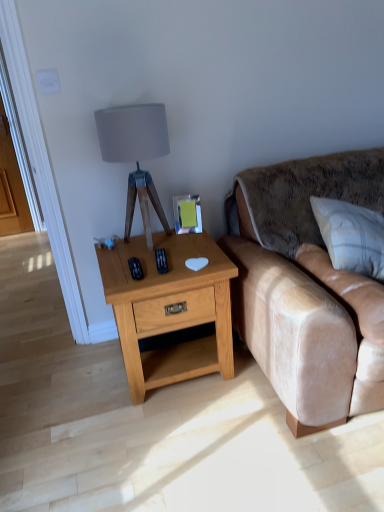
Question: Is the position of white textured pillow at right more distant than that of light oak wood nightstand at center?

Choices:
 (A) yes
 (B) no

Answer: (B)

Question: Is white textured pillow at right not close to light oak wood nightstand at center?

Choices:
 (A) no
 (B) yes

Answer: (A)

Question: From a real-world perspective, is white textured pillow at right on light oak wood nightstand at center?

Choices:
 (A) yes
 (B) no

Answer: (A)

Question: Can you confirm if white textured pillow at right is taller than light oak wood nightstand at center?

Choices:
 (A) yes
 (B) no

Answer: (B)

Question: Is white textured pillow at right in front of light oak wood nightstand at center?

Choices:
 (A) no
 (B) yes

Answer: (B)

Question: In the image, is light oak wood nightstand at center positioned in front of or behind velvet beige couch at right?

Choices:
 (A) front
 (B) behind

Answer: (B)

Question: From a real-world perspective, is light oak wood nightstand at center positioned above or below velvet beige couch at right?

Choices:
 (A) below
 (B) above

Answer: (A)

Question: In terms of height, does light oak wood nightstand at center look taller or shorter compared to velvet beige couch at right?

Choices:
 (A) tall
 (B) short

Answer: (B)

Question: Based on their sizes in the image, would you say light oak wood nightstand at center is bigger or smaller than velvet beige couch at right?

Choices:
 (A) big
 (B) small

Answer: (B)

Question: Relative to white textured pillow at right, is velvet beige couch at right in front or behind?

Choices:
 (A) behind
 (B) front

Answer: (B)

Question: Visually, is velvet beige couch at right positioned to the left or to the right of white textured pillow at right?

Choices:
 (A) right
 (B) left

Answer: (A)

Question: Is velvet beige couch at right situated inside white textured pillow at right or outside?

Choices:
 (A) outside
 (B) inside

Answer: (A)

Question: From a real-world perspective, is velvet beige couch at right positioned above or below white textured pillow at right?

Choices:
 (A) above
 (B) below

Answer: (B)

Question: Is light oak wood nightstand at center to the left or to the right of matte gray fabric lampshade at upper center in the image?

Choices:
 (A) left
 (B) right

Answer: (B)

Question: In terms of height, does light oak wood nightstand at center look taller or shorter compared to matte gray fabric lampshade at upper center?

Choices:
 (A) short
 (B) tall

Answer: (A)